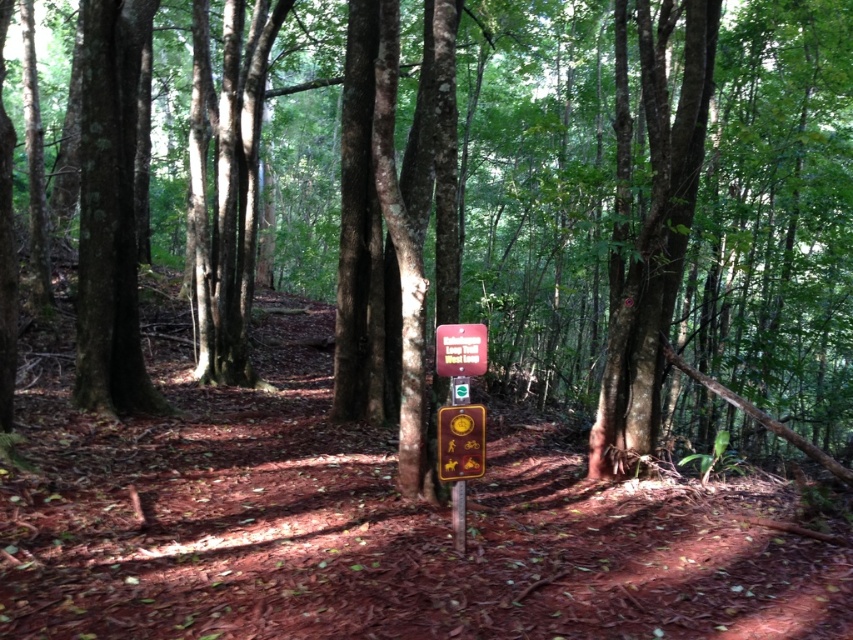
You are a hiker who needs to read the text on both the metallic gold sign at center and the wooden sign at center. Which sign is taller and therefore easier to read from a distance?

The metallic gold sign at center is taller than the wooden sign at center, so it is easier to read from a distance.

You are a hiker who has just arrived at the sign area. You need to place a 12 inch wide backpack between the metallic gold sign at center and the wooden sign at center. Is there enough space between them to fit your backpack?

The distance between the metallic gold sign at center and the wooden sign at center is 13.53 inches. Since your backpack is 12 inches wide, there is enough space to fit it between them.

You are a hiker who just arrived at the trailhead and see the metallic gold sign at center and the wooden sign at center. Which sign is narrower?

The metallic gold sign at center is thinner than the wooden sign at center, so the metallic gold sign at center is narrower.